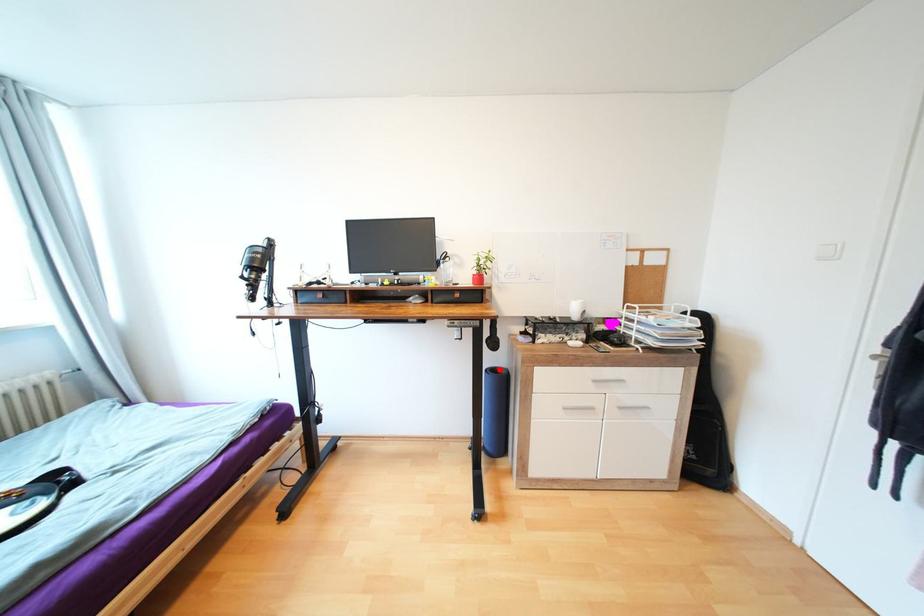
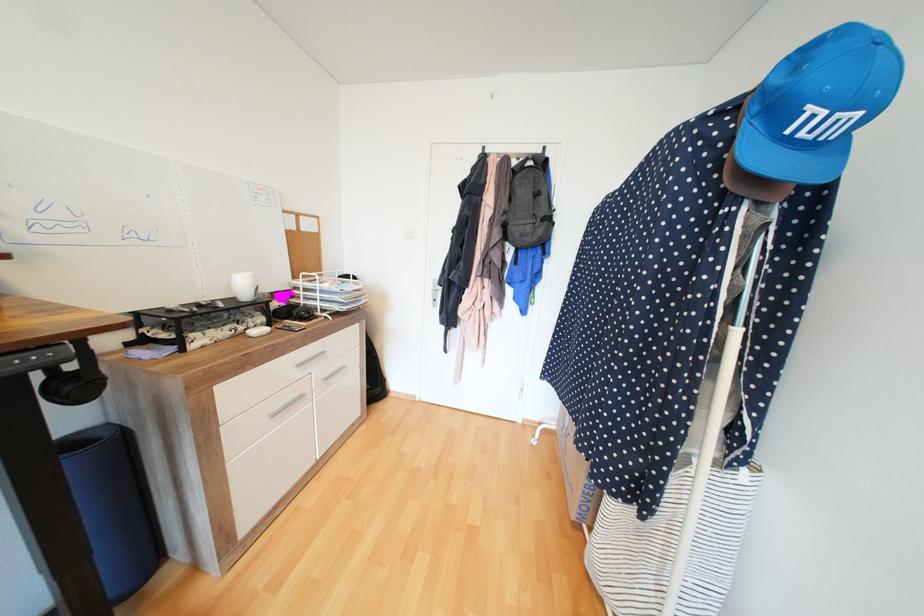
Question: A red point is marked in image1. In image2, is the corresponding 3D point closer to the camera or farther? Reply with the corresponding letter.

Choices:
 (A) The corresponding 3D point is closer.
 (B) The corresponding 3D point is farther.

Answer: (A)